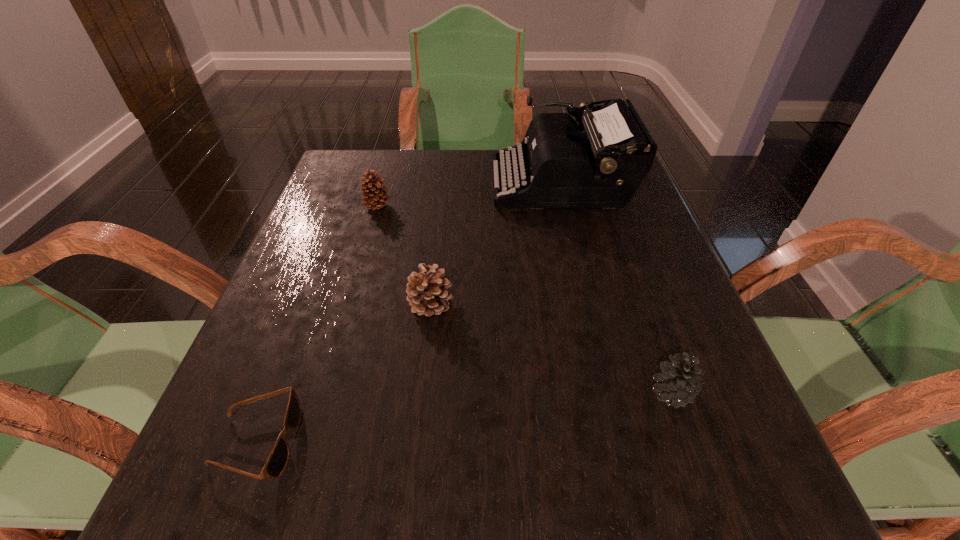
Identify which pinecone is the second closest to the rightmost pinecone. Please provide its 2D coordinates. Your answer should be formatted as a tuple, i.e. [(x, y)], where the tuple contains the x and y coordinates of a point satisfying the conditions above.

[(374, 199)]

Find the location of a particular element. vacant point that satisfies the following two spatial constraints: 1. on the front side of the second farthest pinecone; 2. on the frames of the sunglasses is located at coordinates (417, 442).